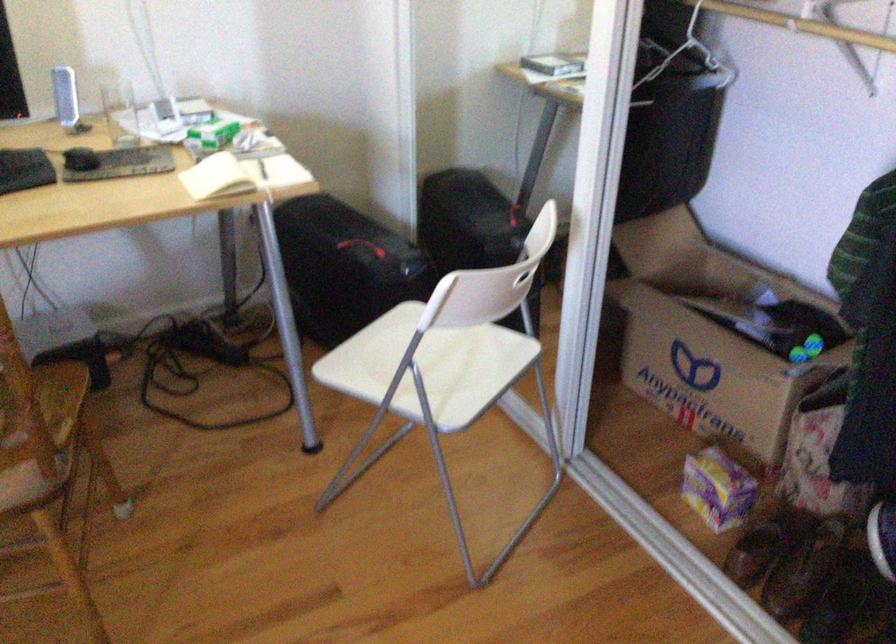
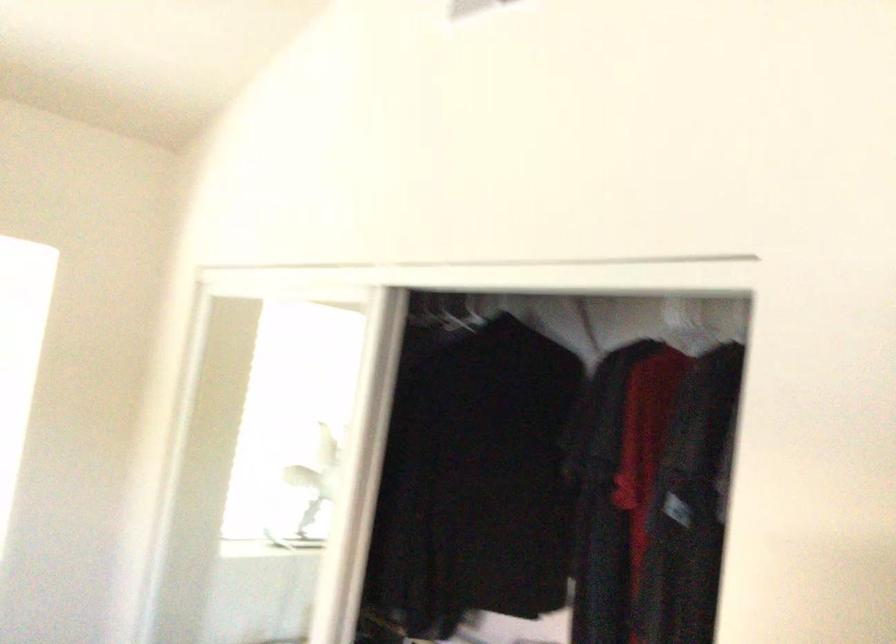
The images are taken continuously from a first-person perspective. In which direction is your viewpoint rotating?

The camera rotated toward right-up.